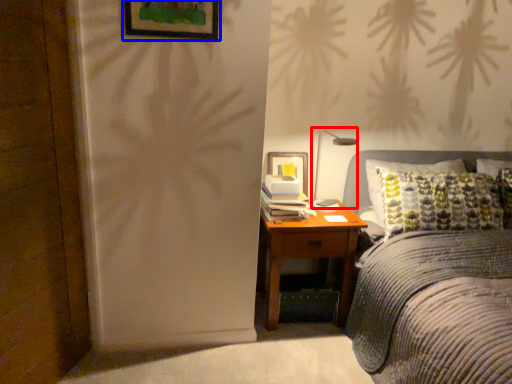
Question: Which object appears farthest to the camera in this image, bedside lamp (highlighted by a red box) or picture frame (highlighted by a blue box)?

Choices:
 (A) bedside lamp
 (B) picture frame

Answer: (A)